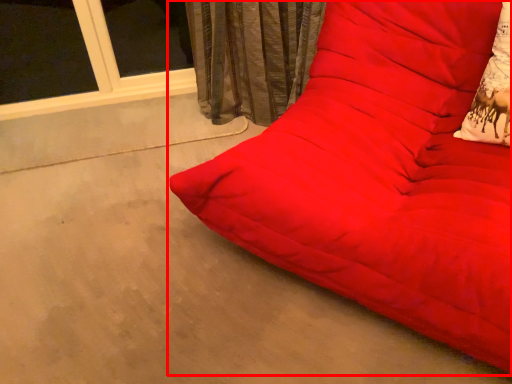
Question: From the image's perspective, considering the relative positions of studio couch (annotated by the red box) and throw pillow in the image provided, where is studio couch (annotated by the red box) located with respect to the staircase?

Choices:
 (A) above
 (B) below

Answer: (B)